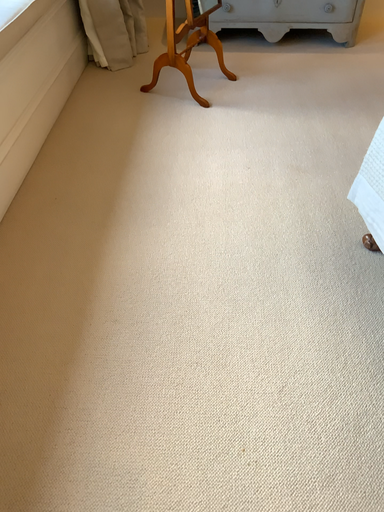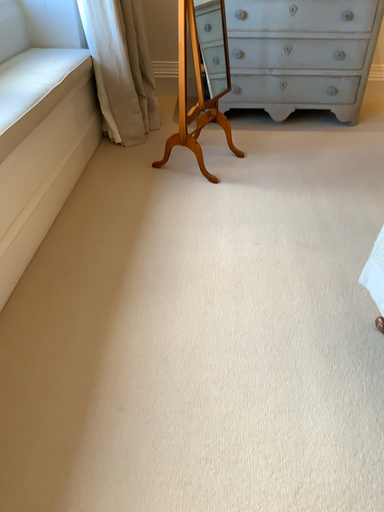
Question: Which way did the camera rotate in the video?

Choices:
 (A) rotated downward
 (B) rotated upward

Answer: (B)